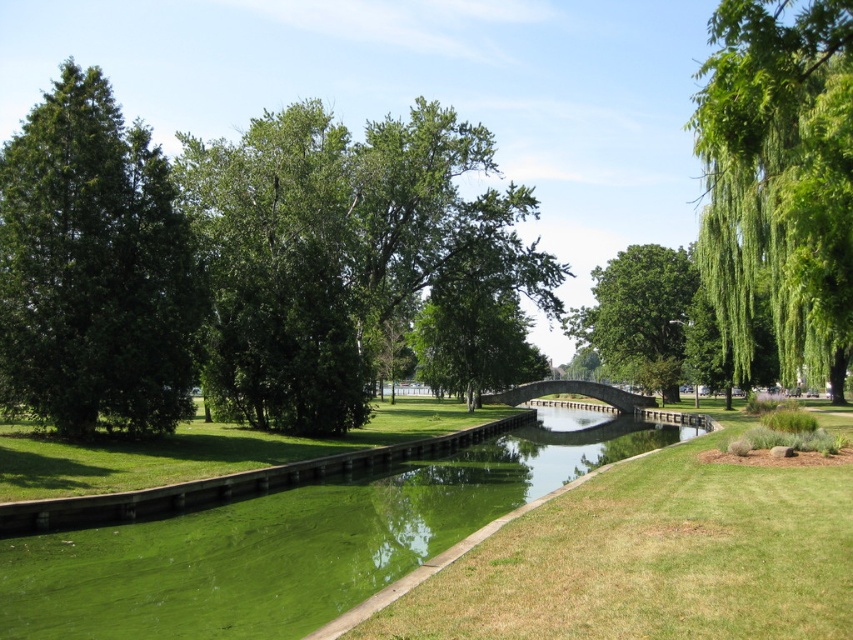
Question: Which of the following is the farthest from the observer?

Choices:
 (A) stone bridge at center
 (B) green algae-covered water at center

Answer: (A)

Question: Which object is closer to the camera taking this photo?

Choices:
 (A) green leafy tree at right
 (B) green glossy tree at left

Answer: (A)

Question: Is green algae-covered water at center to the left of green glossy tree at left from the viewer's perspective?

Choices:
 (A) yes
 (B) no

Answer: (B)

Question: Can you confirm if green algae-covered water at center is positioned below green leafy tree at center?

Choices:
 (A) yes
 (B) no

Answer: (A)

Question: Can you confirm if green leafy tree at right is thinner than stone bridge at center?

Choices:
 (A) no
 (B) yes

Answer: (A)

Question: Based on their relative distances, which object is farther from the green leafy tree at right?

Choices:
 (A) green algae-covered water at center
 (B) green glossy tree at left
 (C) stone bridge at center

Answer: (C)